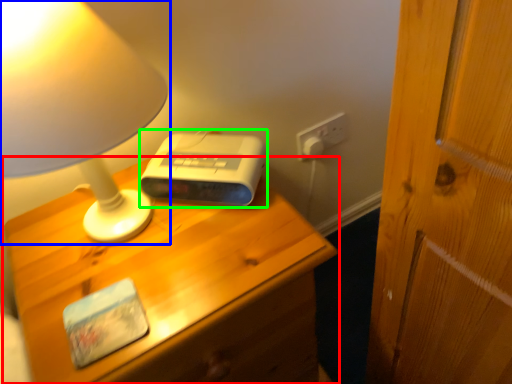
Question: Estimate the real-world distances between objects in this image. Which object is farther from nightstand (highlighted by a red box), lamp (highlighted by a blue box) or gadget (highlighted by a green box)?

Choices:
 (A) lamp
 (B) gadget

Answer: (A)